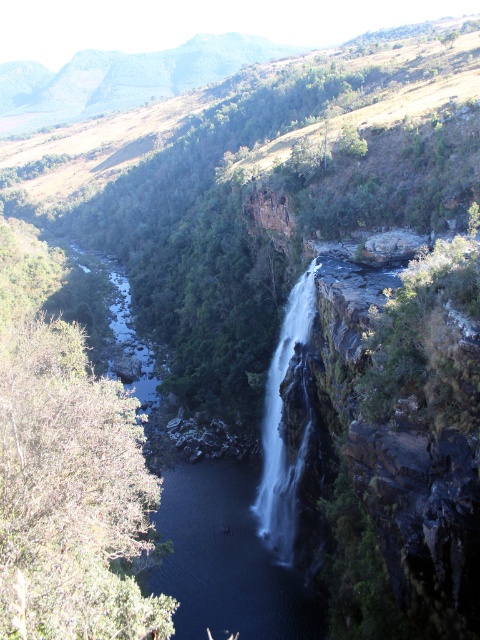
Question: Which object appears farthest from the camera in this image?

Choices:
 (A) clear water at center
 (B) white smooth waterfall at center

Answer: (B)

Question: Which object is closer to the camera taking this photo?

Choices:
 (A) white smooth waterfall at center
 (B) clear water at center

Answer: (B)

Question: Is clear water at center above white smooth waterfall at center?

Choices:
 (A) yes
 (B) no

Answer: (A)

Question: Is clear water at center bigger than white smooth waterfall at center?

Choices:
 (A) no
 (B) yes

Answer: (B)

Question: Does clear water at center appear on the left side of white smooth waterfall at center?

Choices:
 (A) no
 (B) yes

Answer: (B)